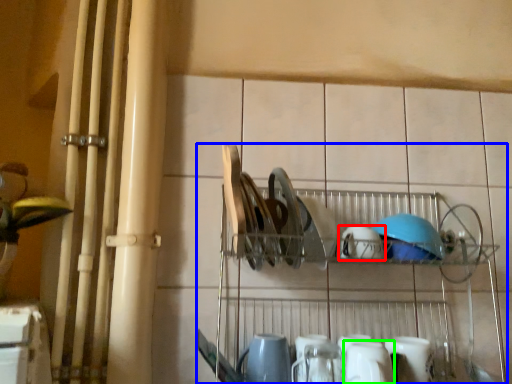
Question: Which object is positioned closest to tableware (highlighted by a red box)? Select from shelf (highlighted by a blue box) and tableware (highlighted by a green box).

Choices:
 (A) shelf
 (B) tableware

Answer: (A)